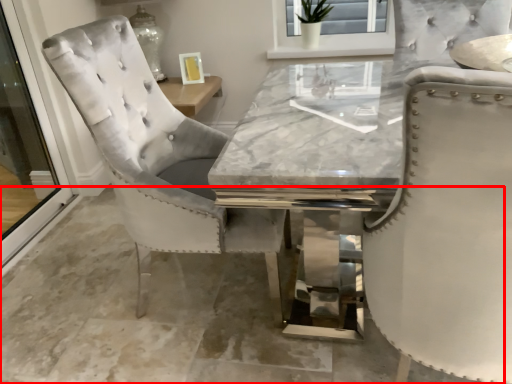
Question: From the image's perspective, where is concrete (annotated by the red box) located in relation to screen door in the image?

Choices:
 (A) below
 (B) above

Answer: (A)